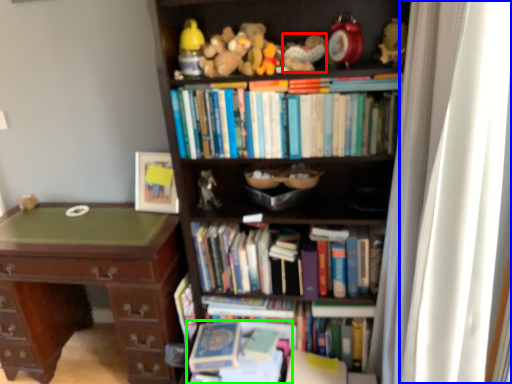
Question: Which object is the closest to the toy (highlighted by a red box)? Choose among these: curtain (highlighted by a blue box) or book (highlighted by a green box).

Choices:
 (A) curtain
 (B) book

Answer: (A)